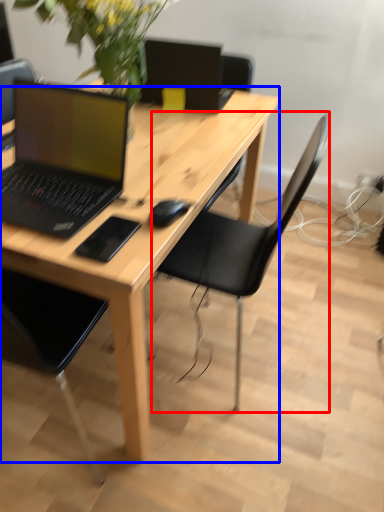
Question: Which point is closer to the camera, chair (highlighted by a red box) or desk (highlighted by a blue box)?

Choices:
 (A) chair
 (B) desk

Answer: (B)